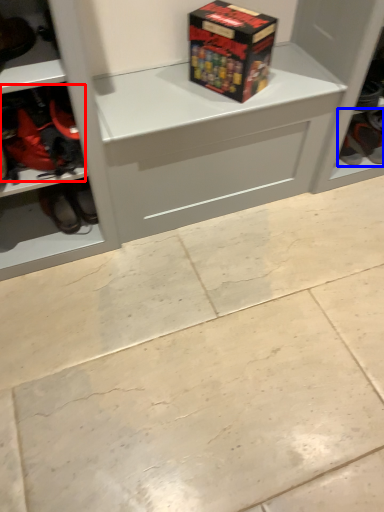
Question: Among these objects, which one is farthest to the camera, footwear (highlighted by a red box) or footwear (highlighted by a blue box)?

Choices:
 (A) footwear
 (B) footwear

Answer: (B)